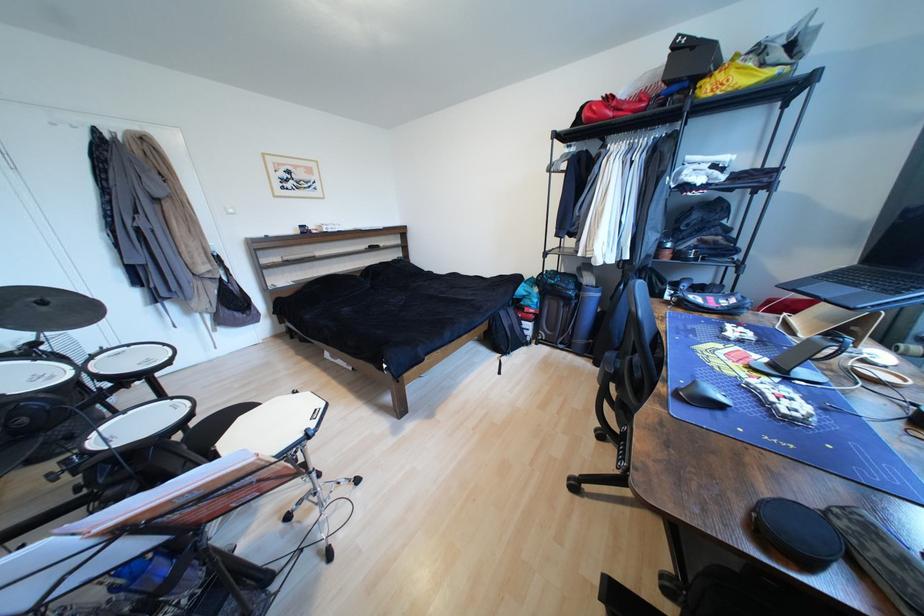
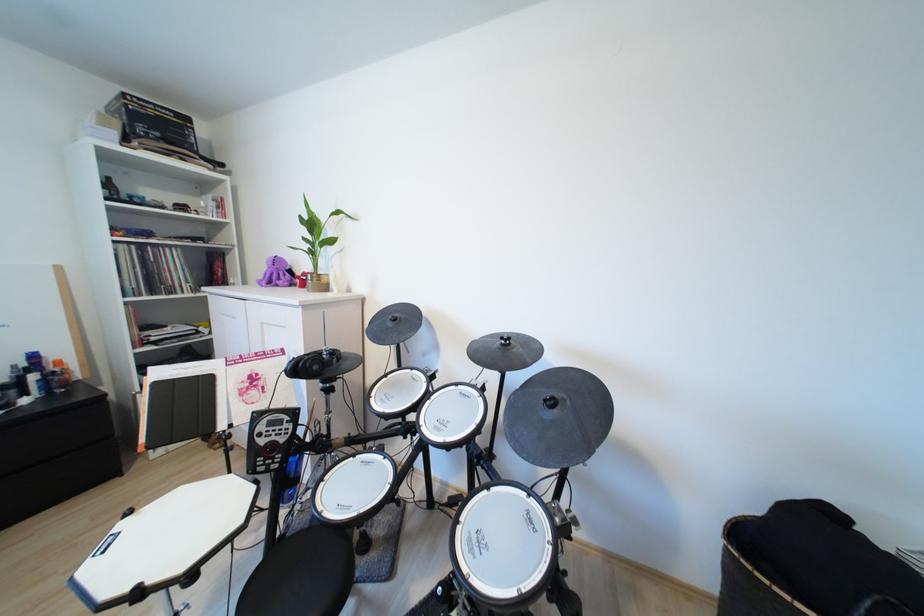
Question: I am providing you with two images of the same scene from different viewpoints. Please identify which objects are invisible in image2.

Choices:
 (A) drum kick pedal
 (B) black headphones
 (C) white drum pad
 (D) none of these

Answer: (D)